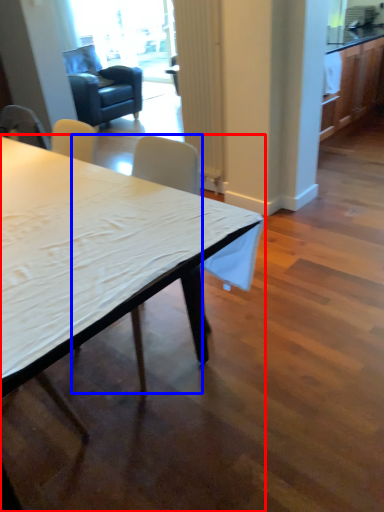
Question: Which of the following is the closest to the observer, desk (highlighted by a red box) or chair (highlighted by a blue box)?

Choices:
 (A) desk
 (B) chair

Answer: (A)